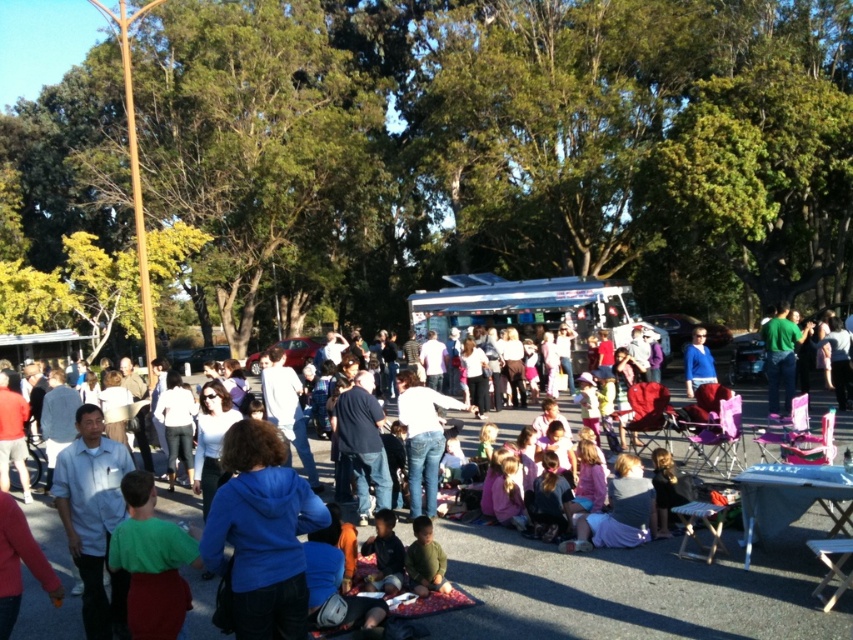
You are standing at the edge of the park and see the blue fleece jacket at lower center. If you want to reach it, how many steps of 0.76 meters each would you need to take?

The blue fleece jacket at lower center is 5.08 meters away from viewer. Since each step is 0.76 meters, dividing 5.08 by 0.76 gives approximately 6.68 steps. Therefore, you would need to take 7 steps to reach it.

You are a photographer at the event and want to capture a photo that includes both the blue fleece jacket at center and the jeans at center. Which object should you focus on first to ensure both are in the frame?

The blue fleece jacket at center is in front of the jeans at center, so you should focus on the blue fleece jacket at center first to ensure both are in the frame.